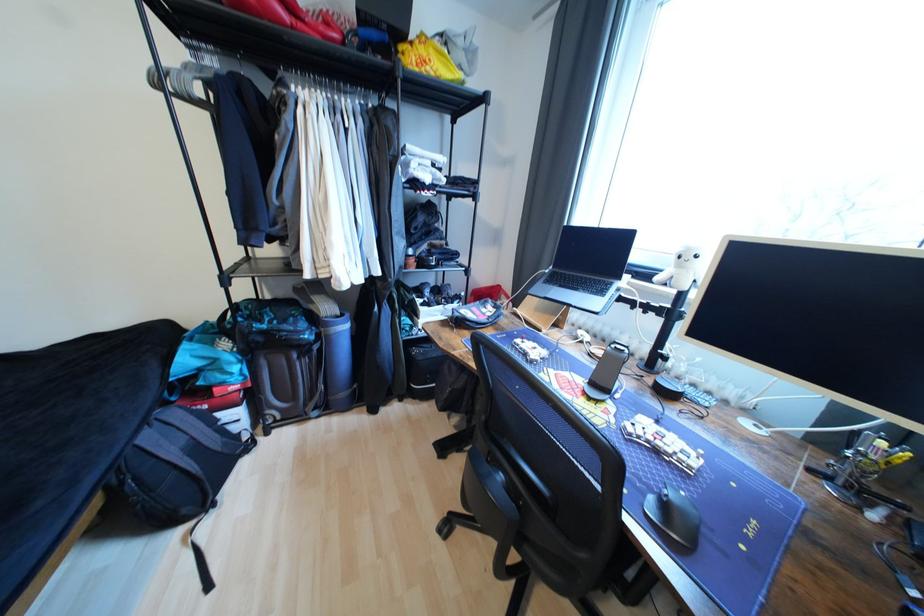
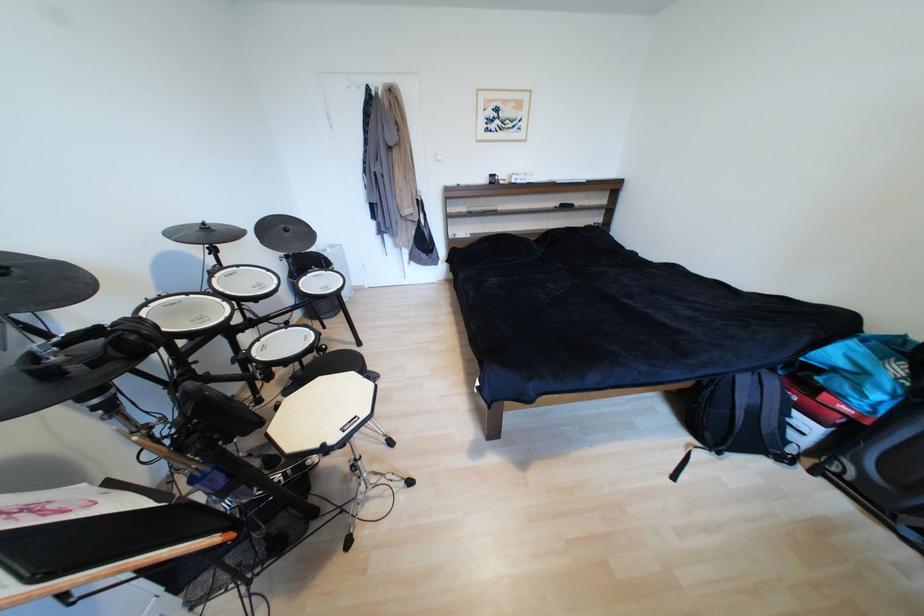
In the scene shown: First-person continuous shooting, in which direction is the camera rotating?

The camera rotated toward left-down.